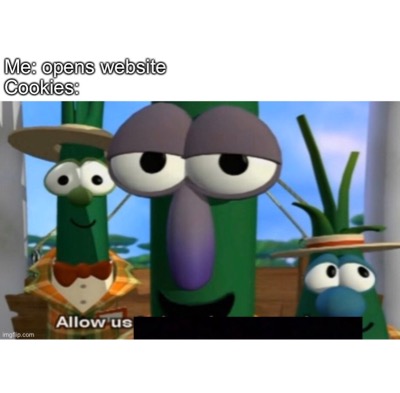
Find the location of a particular element. The width and height of the screenshot is (400, 393). white curtain is located at coordinates (4, 113), (4, 155), (9, 198), (5, 258).